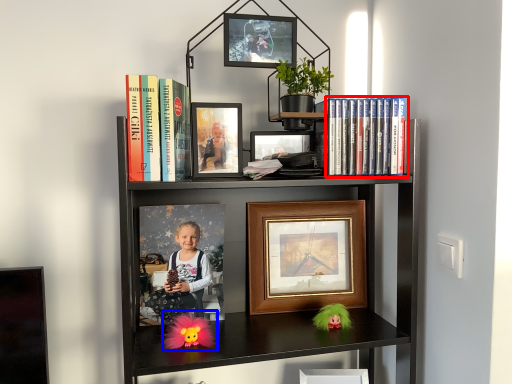
Question: Which object appears farthest to the camera in this image, book (highlighted by a red box) or doll (highlighted by a blue box)?

Choices:
 (A) book
 (B) doll

Answer: (A)